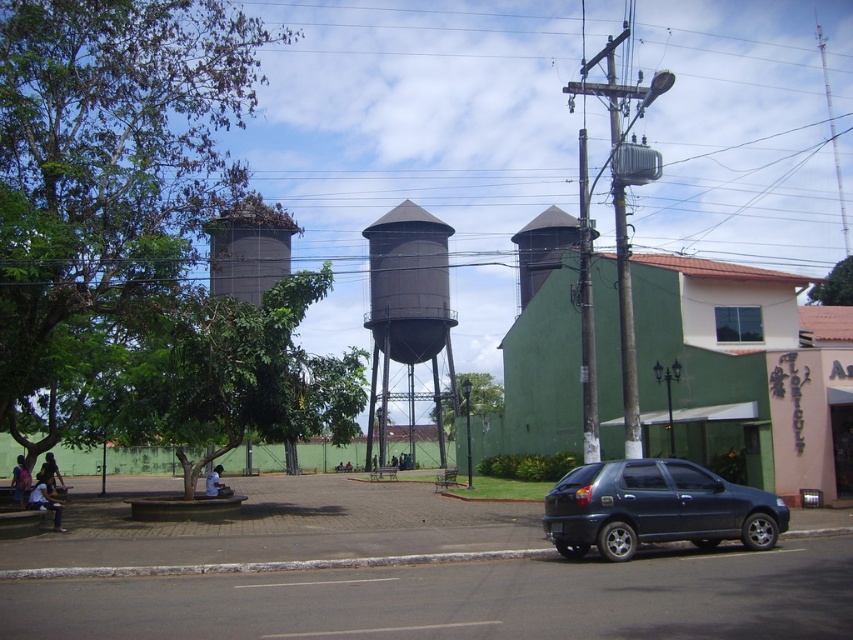
Question: Which object appears closest to the camera in this image?

Choices:
 (A) dark gray metallic water tower at center
 (B) shiny black hatchback at lower right

Answer: (B)

Question: Can you confirm if shiny black hatchback at lower right is positioned below dark gray metallic water tower at center?

Choices:
 (A) yes
 (B) no

Answer: (A)

Question: Which object appears farthest from the camera in this image?

Choices:
 (A) shiny black hatchback at lower right
 (B) dark gray metallic water tower at center

Answer: (B)

Question: Does shiny black hatchback at lower right have a greater width compared to dark gray metallic water tower at center?

Choices:
 (A) yes
 (B) no

Answer: (B)

Question: Which object is farther from the camera taking this photo?

Choices:
 (A) dark gray metallic water tower at center
 (B) shiny black hatchback at lower right

Answer: (A)

Question: Is shiny black hatchback at lower right to the right of dark gray metallic water tower at center from the viewer's perspective?

Choices:
 (A) yes
 (B) no

Answer: (A)